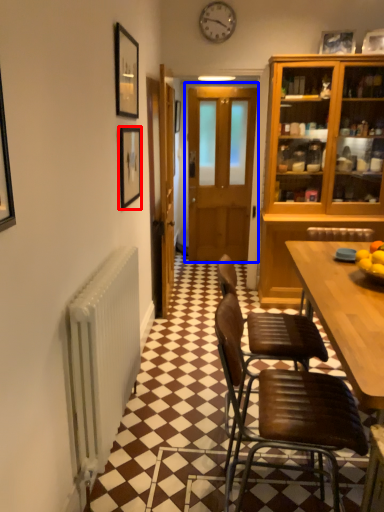
Question: Which object appears closest to the camera in this image, picture frame (highlighted by a red box) or door (highlighted by a blue box)?

Choices:
 (A) picture frame
 (B) door

Answer: (A)